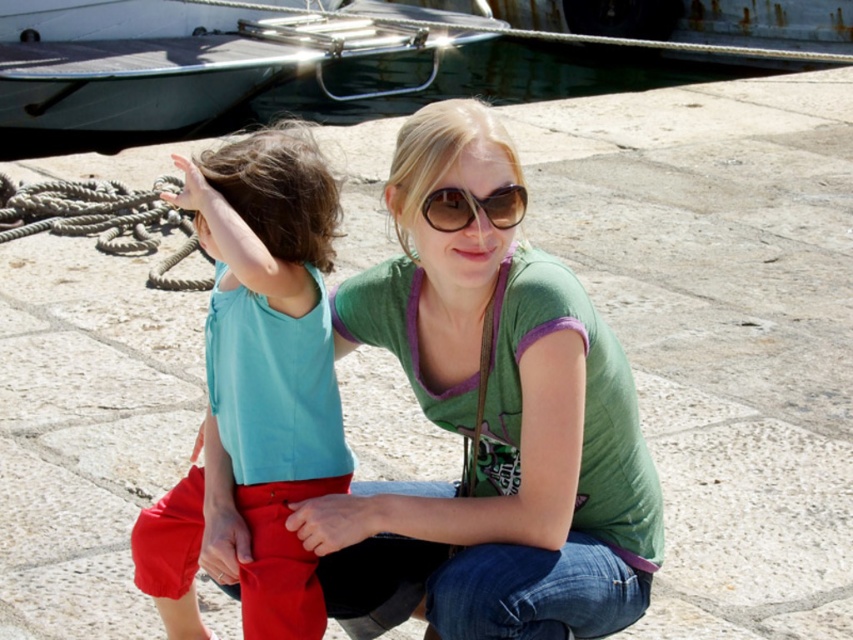
Is point (404, 125) positioned after point (149, 124)?

No, it is not.

Describe the element at coordinates (491, 420) in the screenshot. This screenshot has width=853, height=640. I see `green cotton shirt at center` at that location.

Does point (576, 456) lie in front of point (84, 17)?

Yes, point (576, 456) is in front of point (84, 17).

Where is `green cotton shirt at center`? The width and height of the screenshot is (853, 640). green cotton shirt at center is located at coordinates (491, 420).

Is matte teal tank top at center above metallic gray boat at upper left?

No.

Locate an element on the screen. The height and width of the screenshot is (640, 853). matte teal tank top at center is located at coordinates (257, 385).

Can you confirm if green cotton shirt at center is positioned to the right of brown matte sunglasses at center?

Incorrect, green cotton shirt at center is not on the right side of brown matte sunglasses at center.

Does point (512, 588) come closer to viewer compared to point (474, 211)?

That is True.

I want to click on green cotton shirt at center, so click(x=491, y=420).